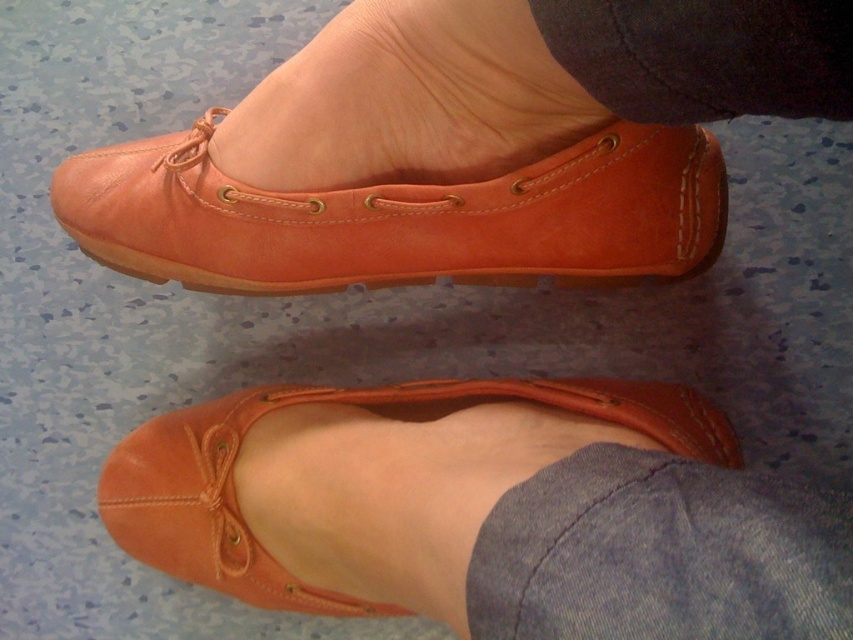
You are a photographer trying to capture the matte leather shoe at upper center and the matte leather shoe at center in a single shot. Which of the two shoes is closer to the camera?

The matte leather shoe at upper center is closer to the camera because it is positioned in front of the matte leather shoe at center.

You are a fashion designer observing the person wearing the matte leather shoe at upper center and the matte leather shoe at center. Which shoe is positioned higher relative to the other?

The matte leather shoe at upper center is positioned higher than the matte leather shoe at center.

You are a fashion designer analyzing the placement of elements in the image. The image contains a pair of orange ballet flats and a point marked at coordinates (399, 188). Which object corresponds to the coordinates provided?

The point at coordinates (399, 188) corresponds to the matte leather shoe at upper center.